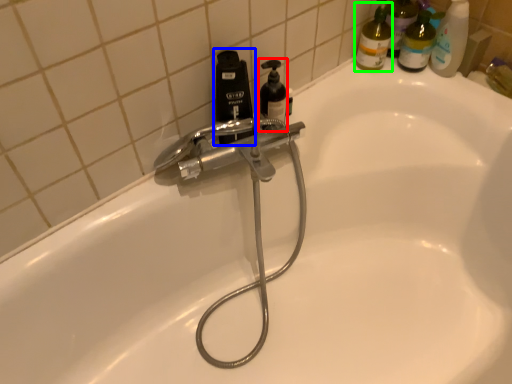
Question: Which object is positioned closest to soap dispenser (highlighted by a red box)? Select from bottle (highlighted by a blue box) and cleaning product (highlighted by a green box).

Choices:
 (A) bottle
 (B) cleaning product

Answer: (A)